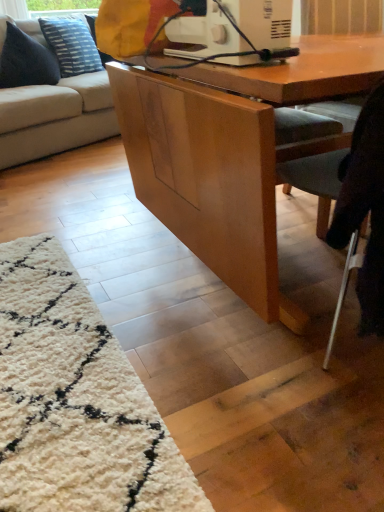
At what (x,y) coordinates should I click in order to perform the action: click on blue textured pillow at upper left, the first pillow from the back. Please return your answer as a coordinate pair (x, y). This screenshot has height=512, width=384. Looking at the image, I should click on (71, 45).

The image size is (384, 512). What do you see at coordinates (362, 216) in the screenshot?
I see `light gray fabric chair at lower right` at bounding box center [362, 216].

This screenshot has width=384, height=512. I want to click on white plastic sewing machine at upper center, so click(x=236, y=32).

What do you see at coordinates (236, 32) in the screenshot? The height and width of the screenshot is (512, 384). I see `white plastic sewing machine at upper center` at bounding box center [236, 32].

What do you see at coordinates (26, 61) in the screenshot?
I see `dark blue fabric pillow at upper left, which ranks as the second pillow in back-to-front order` at bounding box center [26, 61].

I want to click on beige fabric couch at left, so click(55, 117).

Does beige fabric couch at left appear on the right side of blue textured pillow at upper left, the first pillow from the back?

No.

Does beige fabric couch at left have a lesser height compared to blue textured pillow at upper left, the first pillow from the back?

In fact, beige fabric couch at left may be taller than blue textured pillow at upper left, the first pillow from the back.

Are beige fabric couch at left and blue textured pillow at upper left, the second pillow when ordered from front to back, making contact?

No, beige fabric couch at left is not next to blue textured pillow at upper left, the second pillow when ordered from front to back.

You are a GUI agent. You are given a task and a screenshot of the screen. Output one action in this format:
    pyautogui.click(x=<x>, y=<y>)
    Task: Click on the studio couch beneath the blue textured pillow at upper left, the second pillow when ordered from front to back (from a real-world perspective)
    This screenshot has width=384, height=512.
    Given the screenshot: What is the action you would take?
    pyautogui.click(x=55, y=117)

From the image's perspective, relative to white plastic sewing machine at upper center, is light gray fabric chair at lower right above or below?

Based on their image positions, light gray fabric chair at lower right is located beneath white plastic sewing machine at upper center.

Is white plastic sewing machine at upper center a part of light gray fabric chair at lower right?

No, white plastic sewing machine at upper center is not surrounded by light gray fabric chair at lower right.

Considering the positions of points (370, 173) and (265, 38), is point (370, 173) farther from camera compared to point (265, 38)?

No.

Between light gray fabric chair at lower right and white plastic sewing machine at upper center, which one has smaller size?

With smaller size is white plastic sewing machine at upper center.

Which of these two, light gray fabric chair at lower right or beige fabric couch at left, stands shorter?

light gray fabric chair at lower right is shorter.

From a real-world perspective, is light gray fabric chair at lower right physically located above or below beige fabric couch at left?

From a real-world perspective, light gray fabric chair at lower right is physically below beige fabric couch at left.

Is light gray fabric chair at lower right wider than beige fabric couch at left?

Incorrect, the width of light gray fabric chair at lower right does not surpass that of beige fabric couch at left.

How different are the orientations of light gray fabric chair at lower right and beige fabric couch at left in degrees?

They differ by 154 degrees in their facing directions.

From the image's perspective, is light gray fabric chair at lower right below dark blue fabric pillow at upper left, which ranks as the 1th pillow in front-to-back order?

Correct, light gray fabric chair at lower right appears lower than dark blue fabric pillow at upper left, which ranks as the 1th pillow in front-to-back order, in the image.

Could dark blue fabric pillow at upper left, which ranks as the 1th pillow in front-to-back order, be considered to be inside light gray fabric chair at lower right?

No, dark blue fabric pillow at upper left, which ranks as the 1th pillow in front-to-back order, is not inside light gray fabric chair at lower right.

Is light gray fabric chair at lower right taller or shorter than dark blue fabric pillow at upper left, which ranks as the second pillow in back-to-front order?

light gray fabric chair at lower right is taller than dark blue fabric pillow at upper left, which ranks as the second pillow in back-to-front order.

Can we say light gray fabric chair at lower right lies outside blue textured pillow at upper left, the first pillow from the back?

light gray fabric chair at lower right lies outside blue textured pillow at upper left, the first pillow from the back,'s area.

Is point (372, 184) more distant than point (96, 71)?

No.

From the image's perspective, which is above, light gray fabric chair at lower right or blue textured pillow at upper left, the second pillow when ordered from front to back?

blue textured pillow at upper left, the second pillow when ordered from front to back, from the image's perspective.

Are light gray fabric chair at lower right and blue textured pillow at upper left, the second pillow when ordered from front to back, beside each other?

No, light gray fabric chair at lower right is not beside blue textured pillow at upper left, the second pillow when ordered from front to back.

Considering the positions of point (245, 19) and point (78, 29), is point (245, 19) closer or farther from the camera than point (78, 29)?

Point (245, 19) is closer to the camera than point (78, 29).

From a real-world perspective, which object rests below the other?

In real-world perspective, blue textured pillow at upper left, the second pillow when ordered from front to back, is lower.

Which of these two, white plastic sewing machine at upper center or blue textured pillow at upper left, the second pillow when ordered from front to back, is wider?

With larger width is blue textured pillow at upper left, the second pillow when ordered from front to back.

From their relative heights in the image, would you say white plastic sewing machine at upper center is taller or shorter than blue textured pillow at upper left, the first pillow from the back?

In the image, white plastic sewing machine at upper center appears to be shorter than blue textured pillow at upper left, the first pillow from the back.

Which of these two, white plastic sewing machine at upper center or dark blue fabric pillow at upper left, which ranks as the second pillow in back-to-front order, stands shorter?

With less height is white plastic sewing machine at upper center.

Consider the image. Is white plastic sewing machine at upper center to the left or to the right of dark blue fabric pillow at upper left, which ranks as the 1th pillow in front-to-back order, in the image?

white plastic sewing machine at upper center is positioned on dark blue fabric pillow at upper left, which ranks as the 1th pillow in front-to-back order,'s right side.

Based on the photo, does white plastic sewing machine at upper center have a smaller size compared to dark blue fabric pillow at upper left, which ranks as the 1th pillow in front-to-back order?

Indeed, white plastic sewing machine at upper center has a smaller size compared to dark blue fabric pillow at upper left, which ranks as the 1th pillow in front-to-back order.

From the image's perspective, is white plastic sewing machine at upper center above dark blue fabric pillow at upper left, which ranks as the second pillow in back-to-front order?

No.

Find the location of a particular element. The width and height of the screenshot is (384, 512). studio couch below the blue textured pillow at upper left, the second pillow when ordered from front to back (from the image's perspective) is located at coordinates (55, 117).

Locate an element on the screen. This screenshot has height=512, width=384. chair in front of the white plastic sewing machine at upper center is located at coordinates (362, 216).

Which object lies nearer to the anchor point dark blue fabric pillow at upper left, which ranks as the 1th pillow in front-to-back order, blue textured pillow at upper left, the first pillow from the back, or light gray fabric chair at lower right?

blue textured pillow at upper left, the first pillow from the back, lies closer to dark blue fabric pillow at upper left, which ranks as the 1th pillow in front-to-back order, than the other object.

Which object lies nearer to the anchor point dark blue fabric pillow at upper left, which ranks as the second pillow in back-to-front order, white plastic sewing machine at upper center or light gray fabric chair at lower right?

white plastic sewing machine at upper center lies closer to dark blue fabric pillow at upper left, which ranks as the second pillow in back-to-front order, than the other object.

Considering their positions, is white plastic sewing machine at upper center positioned closer to light gray fabric chair at lower right than blue textured pillow at upper left, the first pillow from the back?

white plastic sewing machine at upper center.

Based on their spatial positions, is dark blue fabric pillow at upper left, which ranks as the 1th pillow in front-to-back order, or blue textured pillow at upper left, the first pillow from the back, closer to beige fabric couch at left?

The object closer to beige fabric couch at left is dark blue fabric pillow at upper left, which ranks as the 1th pillow in front-to-back order.

Based on their spatial positions, is light gray fabric chair at lower right or blue textured pillow at upper left, the second pillow when ordered from front to back, further from dark blue fabric pillow at upper left, which ranks as the 1th pillow in front-to-back order?

Among the two, light gray fabric chair at lower right is located further to dark blue fabric pillow at upper left, which ranks as the 1th pillow in front-to-back order.

When comparing their distances from white plastic sewing machine at upper center, does beige fabric couch at left or blue textured pillow at upper left, the second pillow when ordered from front to back, seem closer?

beige fabric couch at left is positioned closer to the anchor white plastic sewing machine at upper center.

From the image, which object appears to be nearer to dark blue fabric pillow at upper left, which ranks as the second pillow in back-to-front order, beige fabric couch at left or blue textured pillow at upper left, the first pillow from the back?

blue textured pillow at upper left, the first pillow from the back, is positioned closer to the anchor dark blue fabric pillow at upper left, which ranks as the second pillow in back-to-front order.

Which object lies nearer to the anchor point dark blue fabric pillow at upper left, which ranks as the 1th pillow in front-to-back order, light gray fabric chair at lower right or beige fabric couch at left?

The object closer to dark blue fabric pillow at upper left, which ranks as the 1th pillow in front-to-back order, is beige fabric couch at left.

Find the location of a particular element. The height and width of the screenshot is (512, 384). studio couch located between light gray fabric chair at lower right and blue textured pillow at upper left, the first pillow from the back, in the depth direction is located at coordinates (55, 117).

At what (x,y) coordinates should I click in order to perform the action: click on pillow between light gray fabric chair at lower right and blue textured pillow at upper left, the first pillow from the back, from front to back. Please return your answer as a coordinate pair (x, y). This screenshot has height=512, width=384. Looking at the image, I should click on (26, 61).

In order to click on desktop computer between light gray fabric chair at lower right and dark blue fabric pillow at upper left, which ranks as the 1th pillow in front-to-back order, along the z-axis in this screenshot , I will do `click(236, 32)`.

In order to click on pillow located between white plastic sewing machine at upper center and blue textured pillow at upper left, the first pillow from the back, in the depth direction in this screenshot , I will do `click(26, 61)`.